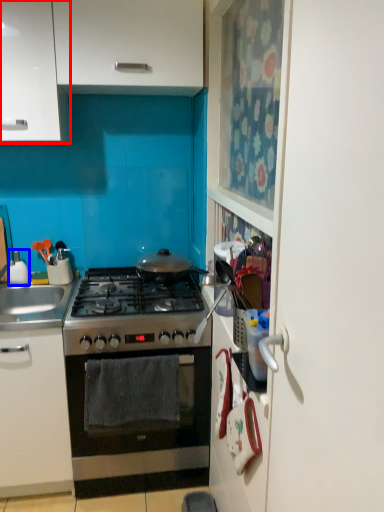
Question: Which point is further to the camera, cabinetry (highlighted by a red box) or appliance (highlighted by a blue box)?

Choices:
 (A) cabinetry
 (B) appliance

Answer: (B)